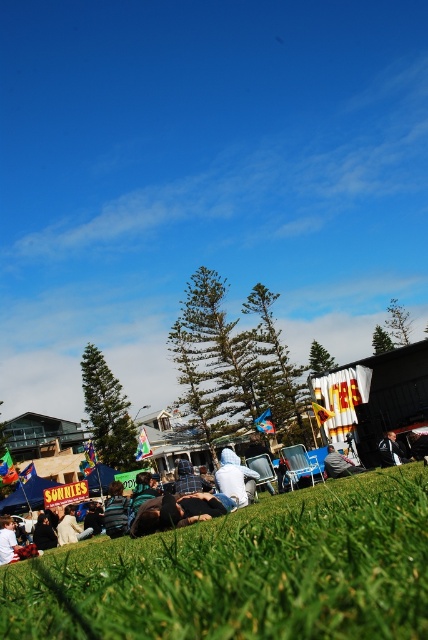
You are a photographer trying to capture a clear shot of the black leather jacket at center without the white fabric umbrella at center blocking it. Since the umbrella is shorter, where should you position yourself relative to the jacket to ensure the umbrella doesn

The white fabric umbrella at center has a lesser height compared to the black leather jacket at center. To avoid the umbrella blocking the jacket, position yourself at a lower angle so that the umbrella

You are standing in the outdoor scene and want to walk from point A to point B. Point A is at coordinates point [348,472] and point B is at coordinates point [379,445]. Which point is closer to you when you start walking?

Point [348,472] is closer to the viewer than point [379,445], so you will start at the closer point and walk towards the farther one.

Based on the photo, you are standing at the center of the image and want to walk towards the green grassy field at lower center. Which direction should you move in?

Since the green grassy field at lower center is located at point (244, 573), you should move downward and slightly to the right to reach it.